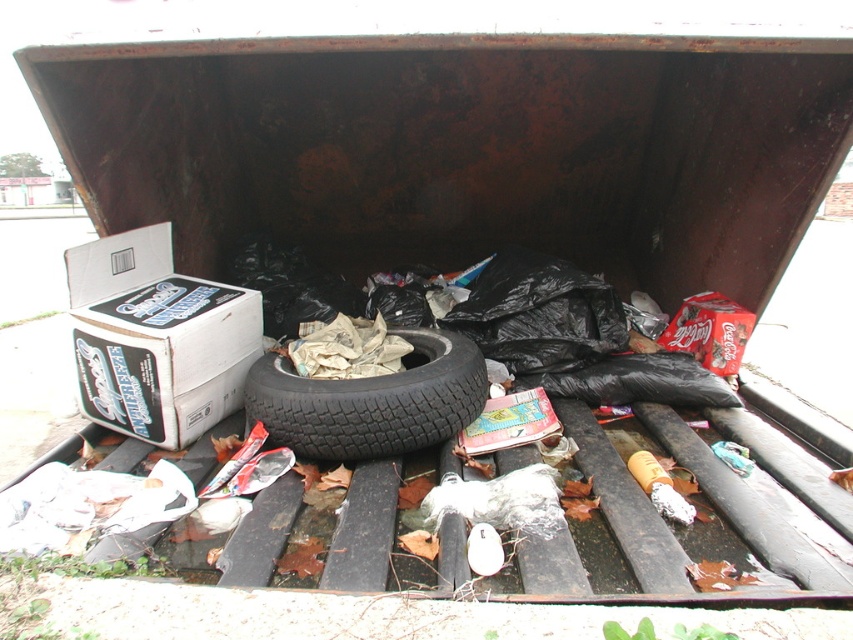
Between white cardboard box at left and black rubber tire at center, which one has more height?

white cardboard box at left is taller.

Which is behind, point (125, 323) or point (372, 440)?

Positioned behind is point (125, 323).

Is point (73, 300) positioned after point (460, 364)?

Yes.

I want to click on white cardboard box at left, so click(x=155, y=339).